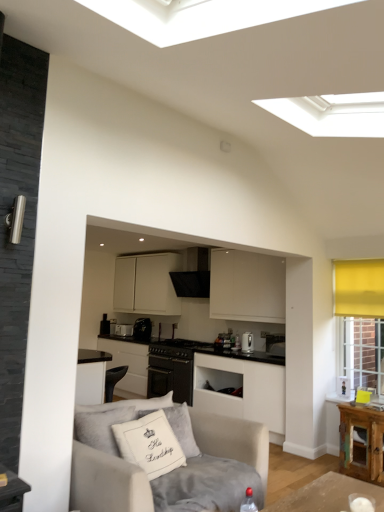
Question: Is the depth of black matte stove at center, the second appliance when ordered from front to back, greater than that of black leather armchair at lower center?

Choices:
 (A) no
 (B) yes

Answer: (B)

Question: From the image's perspective, is black matte stove at center, arranged as the 2th appliance when viewed from the right, under black leather armchair at lower center?

Choices:
 (A) no
 (B) yes

Answer: (A)

Question: Considering the relative sizes of black matte stove at center, positioned as the third appliance in left-to-right order, and black leather armchair at lower center in the image provided, is black matte stove at center, positioned as the third appliance in left-to-right order, bigger than black leather armchair at lower center?

Choices:
 (A) no
 (B) yes

Answer: (B)

Question: Does black matte stove at center, positioned as the third appliance in left-to-right order, lie in front of black leather armchair at lower center?

Choices:
 (A) yes
 (B) no

Answer: (B)

Question: Is black matte stove at center, the second appliance when ordered from front to back, at the right side of black leather armchair at lower center?

Choices:
 (A) yes
 (B) no

Answer: (A)

Question: In terms of width, does satin black toaster at center, which is the fourth appliance from right to left, look wider or thinner when compared to light gray fabric couch at lower left?

Choices:
 (A) wide
 (B) thin

Answer: (B)

Question: Is satin black toaster at center, acting as the first appliance starting from the left, taller or shorter than light gray fabric couch at lower left?

Choices:
 (A) tall
 (B) short

Answer: (B)

Question: Does point (129, 329) appear closer or farther from the camera than point (223, 452)?

Choices:
 (A) farther
 (B) closer

Answer: (A)

Question: Considering their positions, is satin black toaster at center, which is the fourth appliance from right to left, located in front of or behind light gray fabric couch at lower left?

Choices:
 (A) front
 (B) behind

Answer: (B)

Question: From a real-world perspective, is satin silver kettle at center, the 1th appliance when ordered from front to back, physically located above or below black matte oven at center, the first cabinetry when ordered from bottom to top?

Choices:
 (A) above
 (B) below

Answer: (A)

Question: From the image's perspective, is satin silver kettle at center, the 1th appliance when ordered from front to back, above or below black matte oven at center, the first cabinetry when ordered from bottom to top?

Choices:
 (A) above
 (B) below

Answer: (A)

Question: Choose the correct answer: Is satin silver kettle at center, the 1th appliance when ordered from front to back, inside black matte oven at center, which is the 3th cabinetry from top to bottom, or outside it?

Choices:
 (A) outside
 (B) inside

Answer: (A)

Question: Relative to black matte oven at center, which is the 3th cabinetry from top to bottom, is satin silver kettle at center, marked as the 4th appliance in a back-to-front arrangement, in front or behind?

Choices:
 (A) behind
 (B) front

Answer: (B)

Question: From a real-world perspective, is satin black toaster at center, which is the fourth appliance from right to left, above or below black matte stove at center, arranged as the 2th appliance when viewed from the right?

Choices:
 (A) above
 (B) below

Answer: (A)

Question: Is point click(x=130, y=330) closer or farther from the camera than point click(x=155, y=340)?

Choices:
 (A) farther
 (B) closer

Answer: (A)